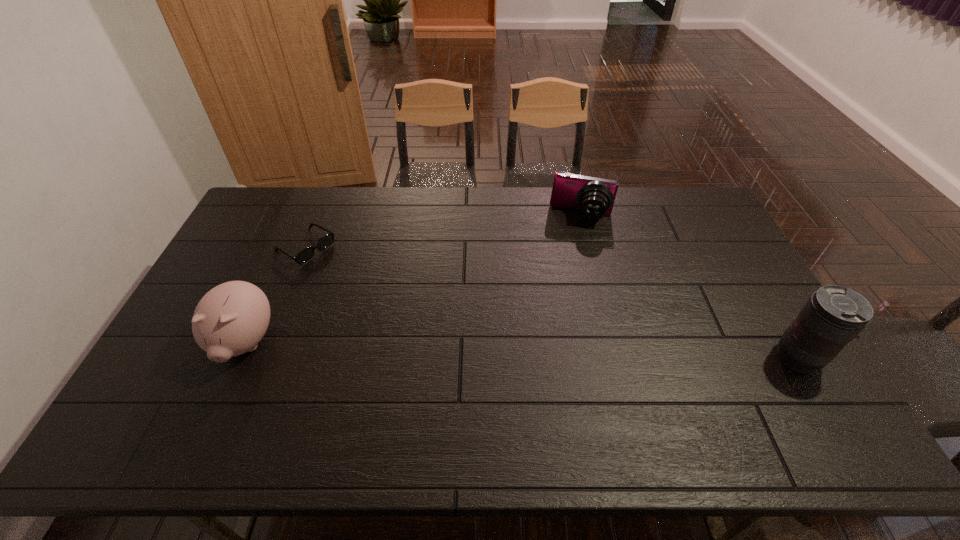
The image size is (960, 540). I want to click on the second tallest object, so click(x=230, y=319).

Where is `the rightmost object`? This screenshot has height=540, width=960. the rightmost object is located at coordinates (833, 316).

The height and width of the screenshot is (540, 960). Find the location of `telephoto lens`. telephoto lens is located at coordinates (833, 316).

Locate an element on the screen. This screenshot has width=960, height=540. sunglasses is located at coordinates (306, 254).

At what (x,y) coordinates should I click in order to perform the action: click on the third object from left to right. Please return your answer as a coordinate pair (x, y). Looking at the image, I should click on (593, 196).

Locate an element on the screen. This screenshot has width=960, height=540. camera is located at coordinates (593, 196).

Find the location of `free space located at the snout of the piggy bank`. free space located at the snout of the piggy bank is located at coordinates (221, 396).

The height and width of the screenshot is (540, 960). I want to click on free space located on the side of the tallest object where the control switches are located, so click(x=664, y=358).

The height and width of the screenshot is (540, 960). What are the coordinates of `vacant region located 0.400m on the side of the tallest object where the control switches are located` in the screenshot? It's located at (623, 358).

Identify the location of vacant region located 0.080m on the side of the tallest object where the control switches are located. (744, 358).